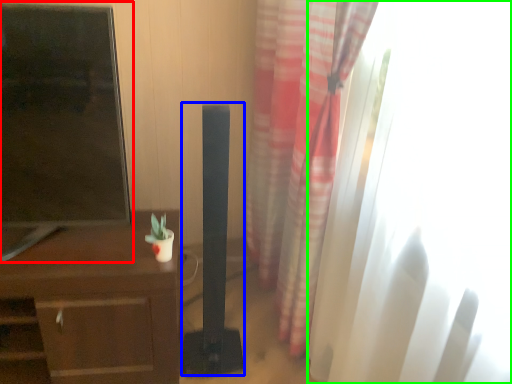
Question: Considering the real-world distances, which object is farthest from tv show (highlighted by a red box)? speaker (highlighted by a blue box) or window (highlighted by a green box)?

Choices:
 (A) speaker
 (B) window

Answer: (B)